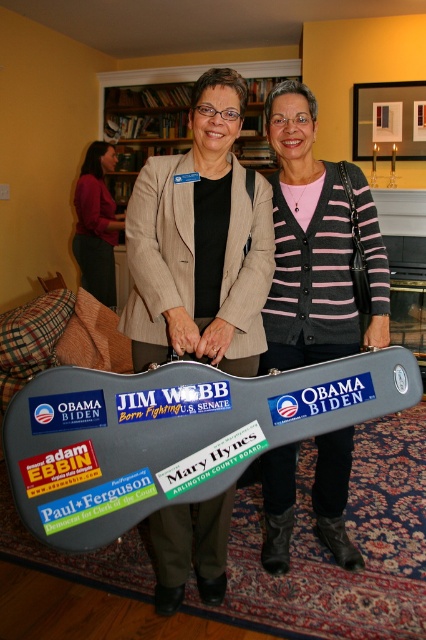
Does gray plastic guitar case at center have a greater height compared to wooden bookshelf at upper center?

No, gray plastic guitar case at center is not taller than wooden bookshelf at upper center.

Is point (351, 380) closer to camera compared to point (135, 170)?

Yes, it is in front of point (135, 170).

Where is `gray plastic guitar case at center`? The image size is (426, 640). gray plastic guitar case at center is located at coordinates (172, 435).

Is gray plastic guitar case at center wider than pink striped sweater at center?

Indeed, gray plastic guitar case at center has a greater width compared to pink striped sweater at center.

Between point (77, 410) and point (348, 326), which one is positioned in front?

Point (77, 410)

Locate an element on the screen. The height and width of the screenshot is (640, 426). gray plastic guitar case at center is located at coordinates (172, 435).

Can you confirm if pink striped sweater at center is thinner than wooden bookshelf at upper center?

Yes, pink striped sweater at center is thinner than wooden bookshelf at upper center.

Does pink striped sweater at center have a larger size compared to wooden bookshelf at upper center?

No, pink striped sweater at center is not bigger than wooden bookshelf at upper center.

Is point (337, 333) positioned before point (180, 129)?

Yes, point (337, 333) is in front of point (180, 129).

Where is `pink striped sweater at center`? pink striped sweater at center is located at coordinates (307, 243).